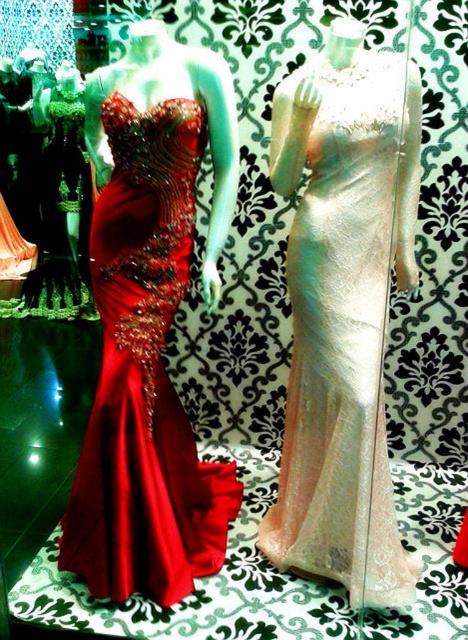
Question: In this image, where is iridescent satin gown at center located relative to shiny satin gown at left?

Choices:
 (A) left
 (B) right

Answer: (B)

Question: Among these objects, which one is nearest to the camera?

Choices:
 (A) shiny satin gown at left
 (B) iridescent satin gown at center

Answer: (B)

Question: Does iridescent satin gown at center have a smaller size compared to shiny satin gown at left?

Choices:
 (A) no
 (B) yes

Answer: (B)

Question: Can you confirm if iridescent satin gown at center is positioned to the right of shiny satin gown at left?

Choices:
 (A) no
 (B) yes

Answer: (B)